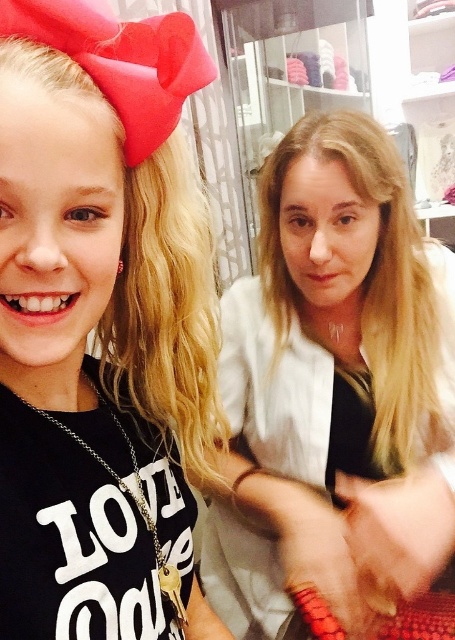
In the scene shown: Does matte black shirt at left have a lesser width compared to smooth white blouse at center?

Indeed, matte black shirt at left has a lesser width compared to smooth white blouse at center.

Can you confirm if matte black shirt at left is bigger than smooth white blouse at center?

No.

Where is `matte black shirt at left`? The height and width of the screenshot is (640, 455). matte black shirt at left is located at coordinates (101, 324).